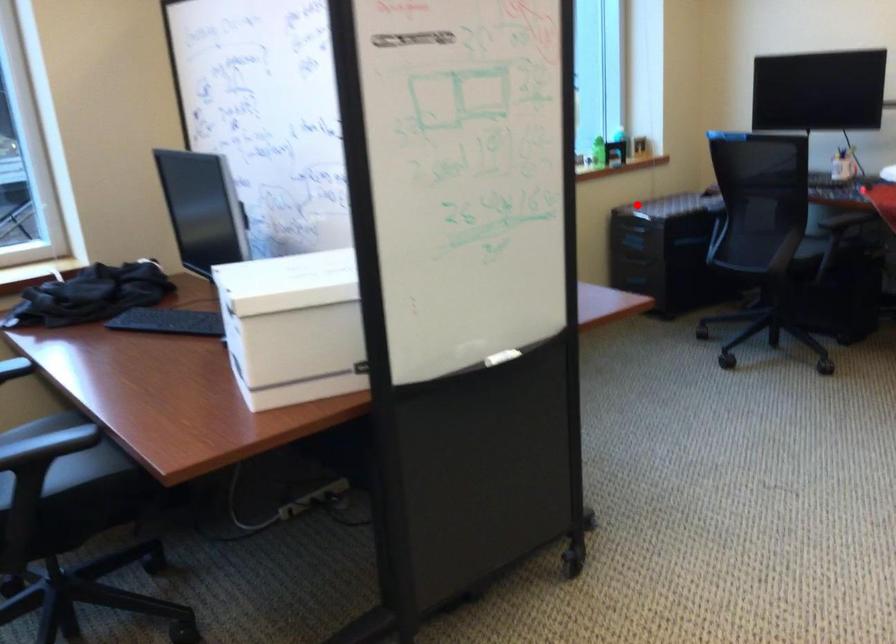
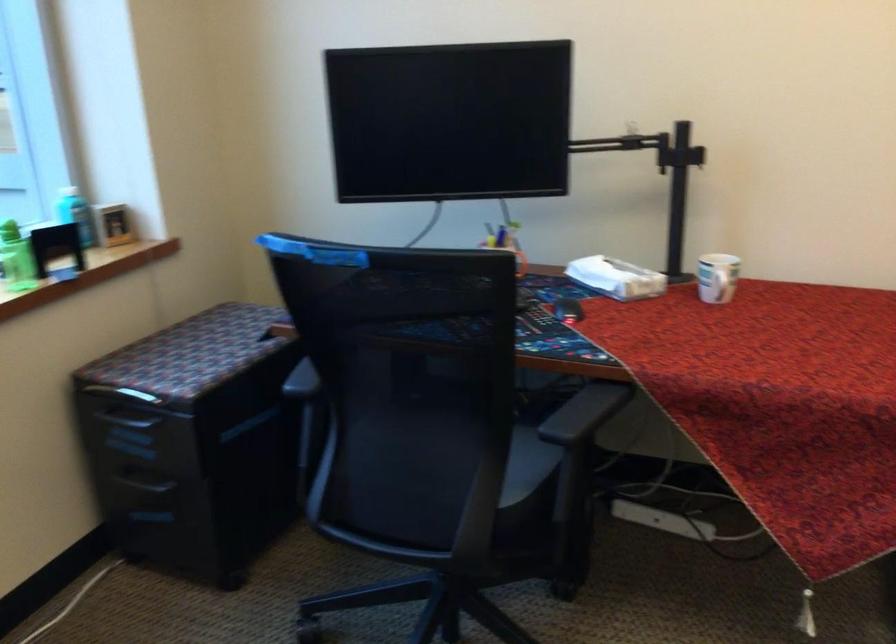
Question: I am providing you with two images of the same scene from different viewpoints. Image1 has a red point marked. In image2, the corresponding 3D location appears at what relative position? Reply with the corresponding letter.

Choices:
 (A) Closer
 (B) Farther

Answer: (A)